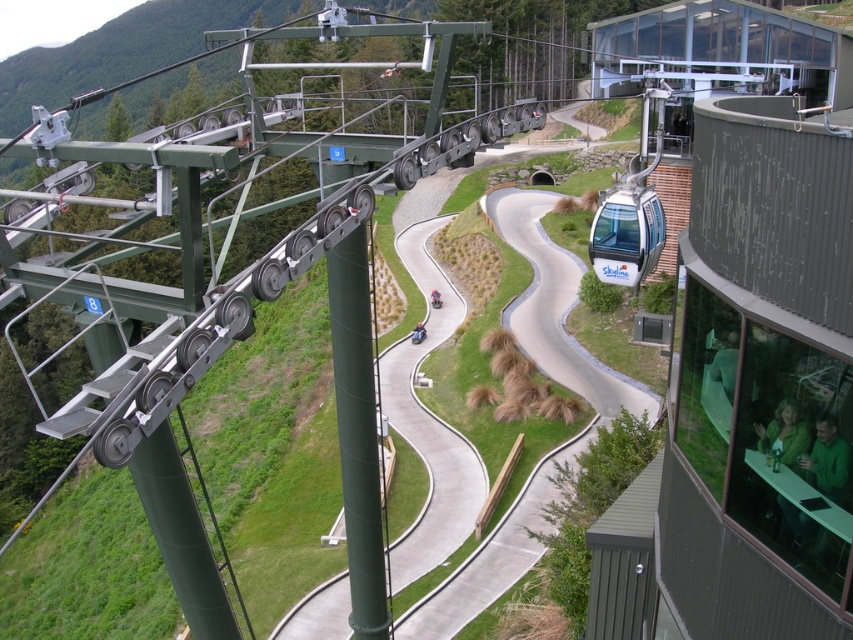
Question: Which point is closer to the camera?

Choices:
 (A) green matte pole at center
 (B) white glossy cable car at center-right

Answer: (A)

Question: Which point is closer to the camera?

Choices:
 (A) (595, 250)
 (B) (381, 544)

Answer: (B)

Question: Is green matte pole at center thinner than white glossy cable car at center-right?

Choices:
 (A) yes
 (B) no

Answer: (A)

Question: Considering the relative positions of green matte pole at center and white glossy cable car at center-right in the image provided, where is green matte pole at center located with respect to white glossy cable car at center-right?

Choices:
 (A) right
 (B) left

Answer: (B)

Question: Does green matte pole at center come behind white glossy cable car at center-right?

Choices:
 (A) yes
 (B) no

Answer: (B)